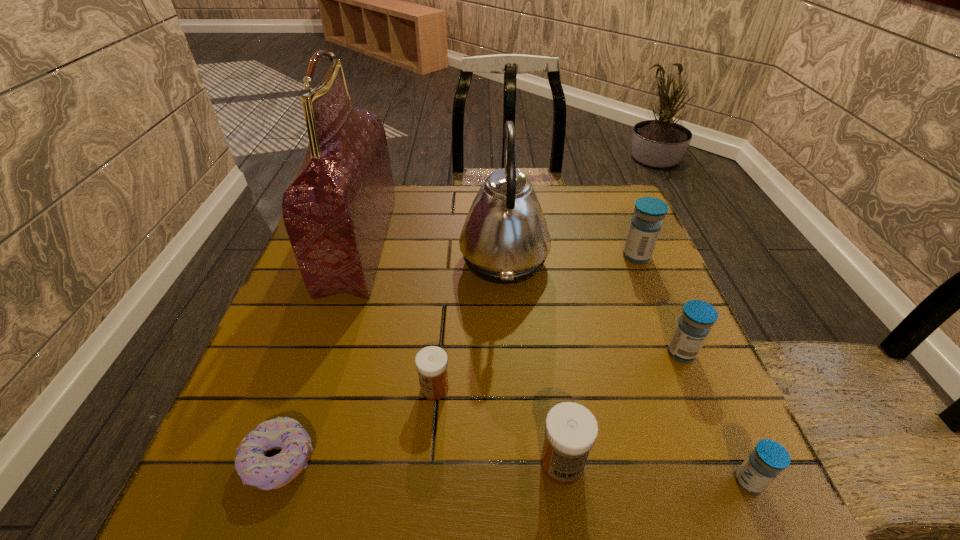
Find the location of a particular element. The height and width of the screenshot is (540, 960). handbag is located at coordinates (336, 210).

The image size is (960, 540). I want to click on kettle, so click(x=505, y=239).

I want to click on the farthest blue medicine, so click(x=646, y=223).

The width and height of the screenshot is (960, 540). I want to click on the third tallest object, so click(646, 223).

You are a GUI agent. You are given a task and a screenshot of the screen. Output one action in this format:
    pyautogui.click(x=<x>, y=<y>)
    Task: Click on the second farthest medicine
    
    Given the screenshot: What is the action you would take?
    pyautogui.click(x=694, y=325)

The height and width of the screenshot is (540, 960). In order to click on the second smallest blue medicine in this screenshot , I will do `click(694, 325)`.

I want to click on the bigger white medicine, so click(571, 430).

This screenshot has width=960, height=540. I want to click on the fourth medicine from right to left, so click(x=571, y=430).

This screenshot has width=960, height=540. Identify the location of the third nearest medicine. (431, 362).

I want to click on the leftmost medicine, so click(x=431, y=362).